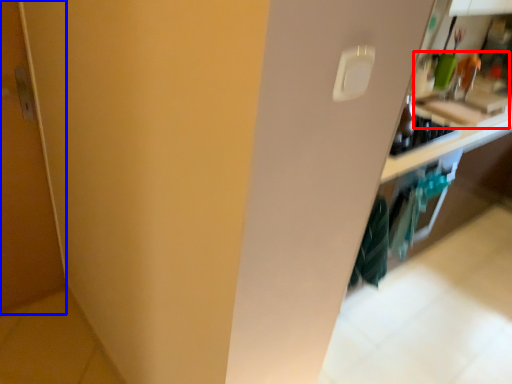
Question: Which of the following is the farthest to the observer, sink (highlighted by a red box) or door (highlighted by a blue box)?

Choices:
 (A) sink
 (B) door

Answer: (A)